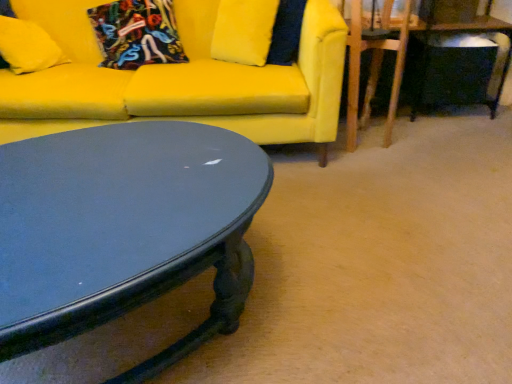
Question: Would you say velvet floral pillow at upper left, placed as the 2th pillow when sorted from left to right, is outside wooden swivel chair at right?

Choices:
 (A) yes
 (B) no

Answer: (A)

Question: Considering the relative sizes of velvet floral pillow at upper left, placed as the 2th pillow when sorted from left to right, and wooden swivel chair at right in the image provided, is velvet floral pillow at upper left, placed as the 2th pillow when sorted from left to right, taller than wooden swivel chair at right?

Choices:
 (A) yes
 (B) no

Answer: (B)

Question: Considering the relative sizes of velvet floral pillow at upper left, acting as the 1th pillow starting from the right, and wooden swivel chair at right in the image provided, is velvet floral pillow at upper left, acting as the 1th pillow starting from the right, bigger than wooden swivel chair at right?

Choices:
 (A) no
 (B) yes

Answer: (B)

Question: Is velvet floral pillow at upper left, placed as the 2th pillow when sorted from left to right, surrounding wooden swivel chair at right?

Choices:
 (A) yes
 (B) no

Answer: (B)

Question: Considering the relative positions of velvet floral pillow at upper left, acting as the 1th pillow starting from the right, and wooden swivel chair at right in the image provided, is velvet floral pillow at upper left, acting as the 1th pillow starting from the right, behind wooden swivel chair at right?

Choices:
 (A) no
 (B) yes

Answer: (B)

Question: From a real-world perspective, is velvet floral pillow at upper left, acting as the 1th pillow starting from the right, over wooden swivel chair at right?

Choices:
 (A) no
 (B) yes

Answer: (B)

Question: Does wooden swivel chair at right turn towards matte yellow pillow at upper left, the second pillow positioned from the right?

Choices:
 (A) yes
 (B) no

Answer: (B)

Question: Is wooden swivel chair at right to the left of matte yellow pillow at upper left, marked as the 1th pillow in a left-to-right arrangement, from the viewer's perspective?

Choices:
 (A) no
 (B) yes

Answer: (A)

Question: From the image's perspective, is wooden swivel chair at right located beneath matte yellow pillow at upper left, marked as the 1th pillow in a left-to-right arrangement?

Choices:
 (A) no
 (B) yes

Answer: (B)

Question: Considering the relative sizes of wooden swivel chair at right and matte yellow pillow at upper left, marked as the 1th pillow in a left-to-right arrangement, in the image provided, is wooden swivel chair at right wider than matte yellow pillow at upper left, marked as the 1th pillow in a left-to-right arrangement,?

Choices:
 (A) no
 (B) yes

Answer: (B)

Question: Is wooden swivel chair at right positioned before matte yellow pillow at upper left, marked as the 1th pillow in a left-to-right arrangement?

Choices:
 (A) yes
 (B) no

Answer: (A)

Question: Is wooden swivel chair at right turned away from matte yellow pillow at upper left, the second pillow positioned from the right?

Choices:
 (A) no
 (B) yes

Answer: (A)

Question: Does matte black table at lower right have a lesser height compared to wooden swivel chair at right?

Choices:
 (A) no
 (B) yes

Answer: (B)